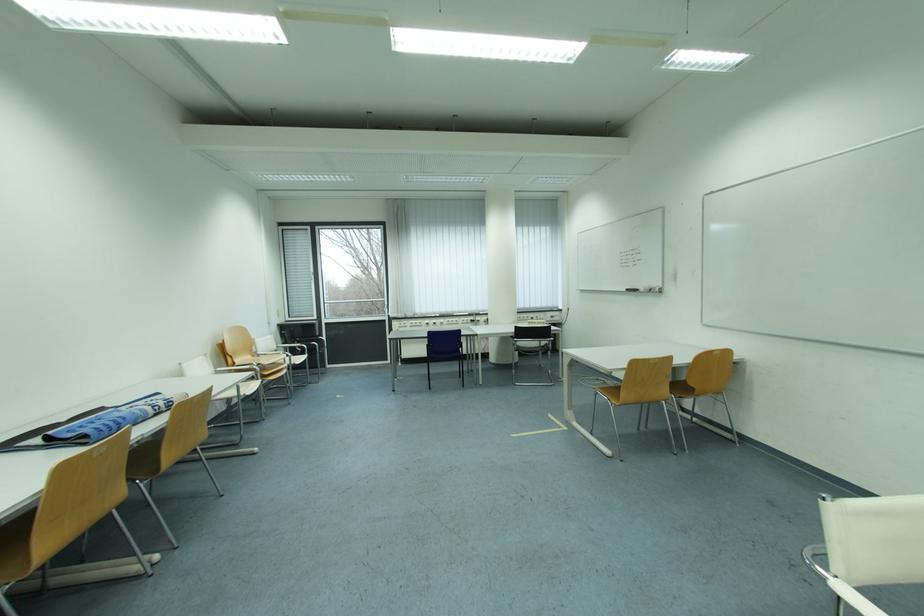
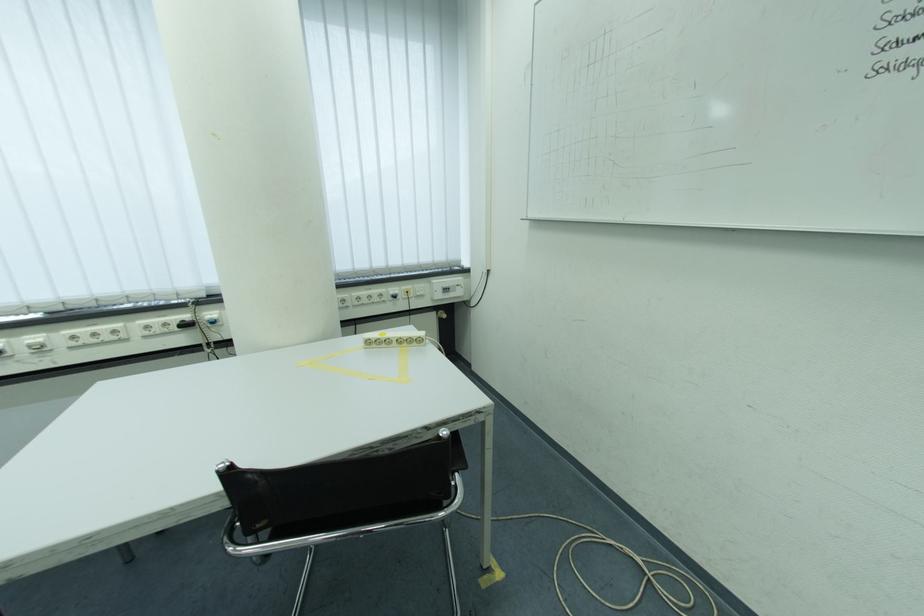
Where in the second image is the point corresponding to the point at 487,323 from the first image?

(223, 325)